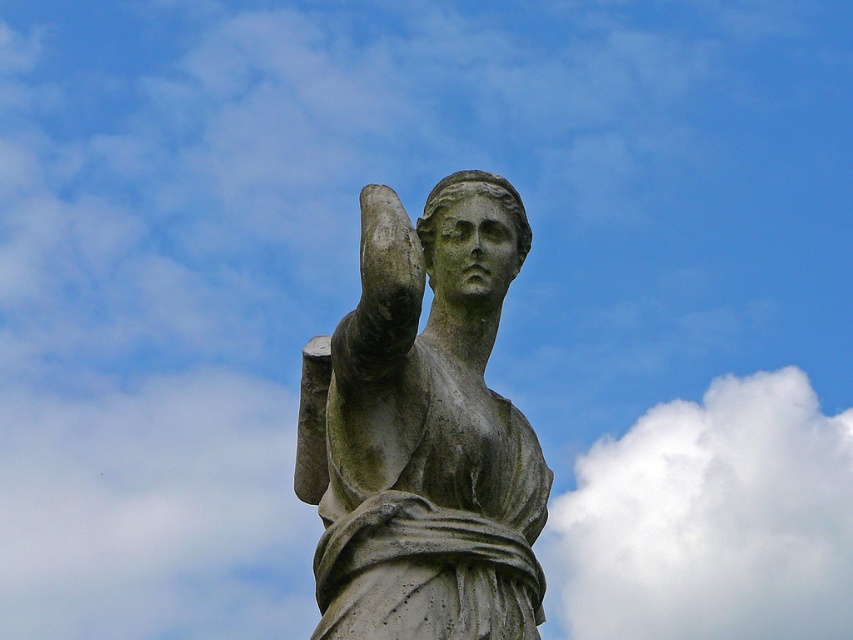
You are standing in front of the statue and want to place a small flower bouquet exactly at the point with coordinates point (422, 429). Based on the description, where on the statue should you place the bouquet?

The point (422, 429) is located on the stone statue at center, so you should place the bouquet on the stone statue at center.

You are an art student analyzing the composition of the image. Based on the sizes of the stone statue at center and the white fluffy cloud at upper center, which one do you think is depicted as larger in the artwork?

The white fluffy cloud at upper center is larger than the stone statue at center, so the cloud is depicted as larger in the artwork.

You are an art student observing the classical statue and the cloud in the sky. Which object is closer to you, the stone statue at center or the white fluffy cloud at upper center?

The stone statue at center is closer to you because it is in front of the white fluffy cloud at upper center.